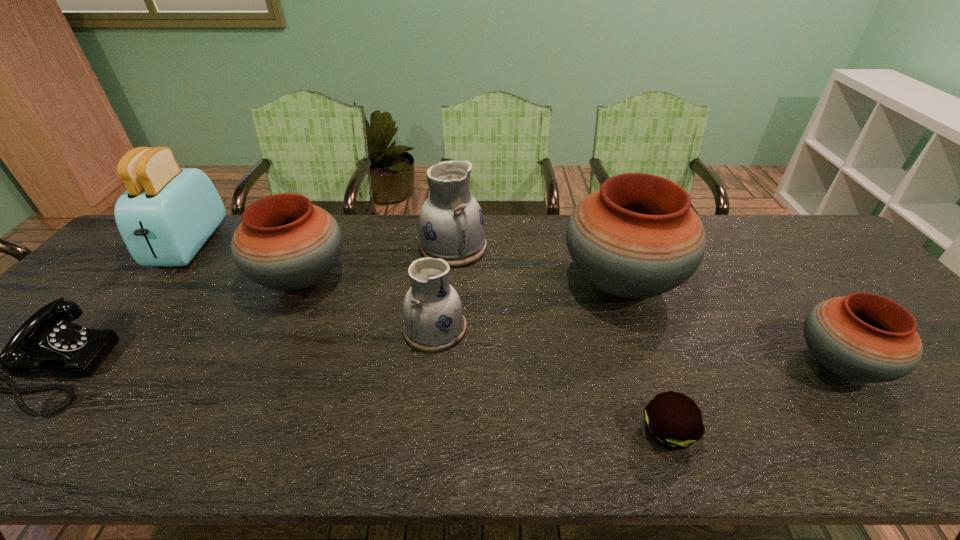
Image resolution: width=960 pixels, height=540 pixels. I want to click on object at the right edge, so click(865, 337).

At what (x,y) coordinates should I click in order to perform the action: click on object positioned at the far left corner. Please return your answer as a coordinate pair (x, y). The image size is (960, 540). Looking at the image, I should click on (167, 213).

In the image, there is a desktop. Where is `vacant space at the far edge`? vacant space at the far edge is located at coordinates (493, 258).

The height and width of the screenshot is (540, 960). Identify the location of blank area at the near edge. (85, 422).

You are a GUI agent. You are given a task and a screenshot of the screen. Output one action in this format:
    pyautogui.click(x=<x>, y=<y>)
    Task: Click on the free spot at the left edge of the desktop
    The image size is (960, 540).
    Given the screenshot: What is the action you would take?
    pyautogui.click(x=102, y=316)

Locate an element on the screen. vacant space at the right edge of the desktop is located at coordinates (953, 371).

At what (x,y) coordinates should I click in order to perform the action: click on vacant area between the second red pottery from right to left and the bigger blue pottery. Please return your answer as a coordinate pair (x, y). The height and width of the screenshot is (540, 960). Looking at the image, I should click on (538, 264).

The image size is (960, 540). What are the coordinates of `unoccupied position between the smaller blue pottery and the smallest red pottery` in the screenshot? It's located at [636, 346].

Where is `free point between the third shortest object and the shortest object`? free point between the third shortest object and the shortest object is located at coordinates (753, 398).

Find the location of a particular element. The width and height of the screenshot is (960, 540). free spot between the second biggest red pottery and the shortest object is located at coordinates (484, 355).